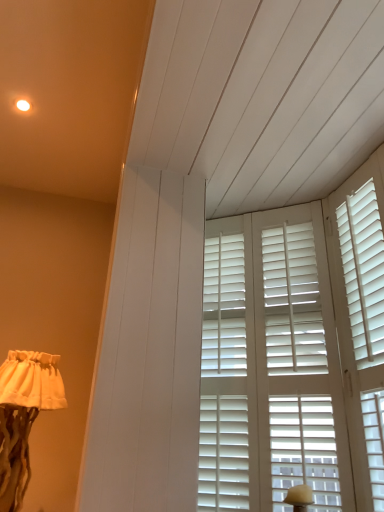
Question: Considering the positions of white matte shutters at center and white fabric lampshade at lower left in the image, is white matte shutters at center taller or shorter than white fabric lampshade at lower left?

Choices:
 (A) short
 (B) tall

Answer: (B)

Question: From the image's perspective, relative to white fabric lampshade at lower left, is white matte shutters at center above or below?

Choices:
 (A) above
 (B) below

Answer: (A)

Question: Considering the positions of white matte shutters at center and white fabric lampshade at lower left in the image, is white matte shutters at center bigger or smaller than white fabric lampshade at lower left?

Choices:
 (A) small
 (B) big

Answer: (A)

Question: Which is correct: white fabric lampshade at lower left is inside white matte shutters at center, or outside of it?

Choices:
 (A) outside
 (B) inside

Answer: (A)

Question: Is point (21, 434) positioned closer to the camera than point (258, 359)?

Choices:
 (A) closer
 (B) farther

Answer: (B)

Question: In the image, is white fabric lampshade at lower left on the left side or the right side of white matte shutters at center?

Choices:
 (A) left
 (B) right

Answer: (A)

Question: Is white fabric lampshade at lower left taller or shorter than white matte shutters at center?

Choices:
 (A) short
 (B) tall

Answer: (A)